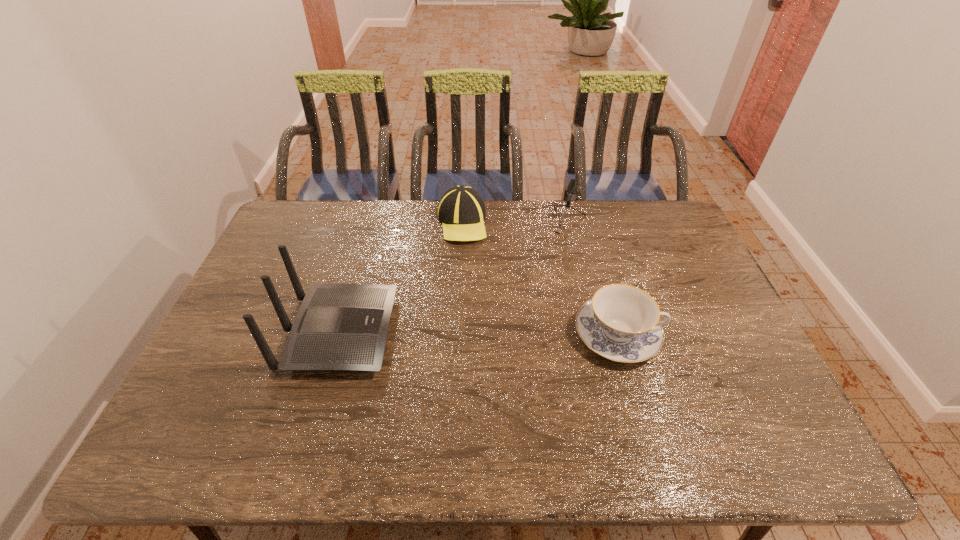
Locate an element on the screen. empty space between the second object from left to right and the chinaware is located at coordinates (540, 279).

Select which object appears as the closest to the microphone. Please provide its 2D coordinates. Your answer should be formatted as a tuple, i.e. [(x, y)], where the tuple contains the x and y coordinates of a point satisfying the conditions above.

[(461, 210)]

At what (x,y) coordinates should I click in order to perform the action: click on the third closest object to the leftmost object. Please return your answer as a coordinate pair (x, y). The image size is (960, 540). Looking at the image, I should click on (621, 322).

Locate an element on the screen. The image size is (960, 540). free space that satisfies the following two spatial constraints: 1. on the front side of the microphone; 2. with the handle on the side of the chinaware is located at coordinates (584, 335).

At what (x,y) coordinates should I click in order to perform the action: click on free region that satisfies the following two spatial constraints: 1. on the front side of the microphone; 2. with the handle on the side of the chinaware. Please return your answer as a coordinate pair (x, y). Looking at the image, I should click on (584, 335).